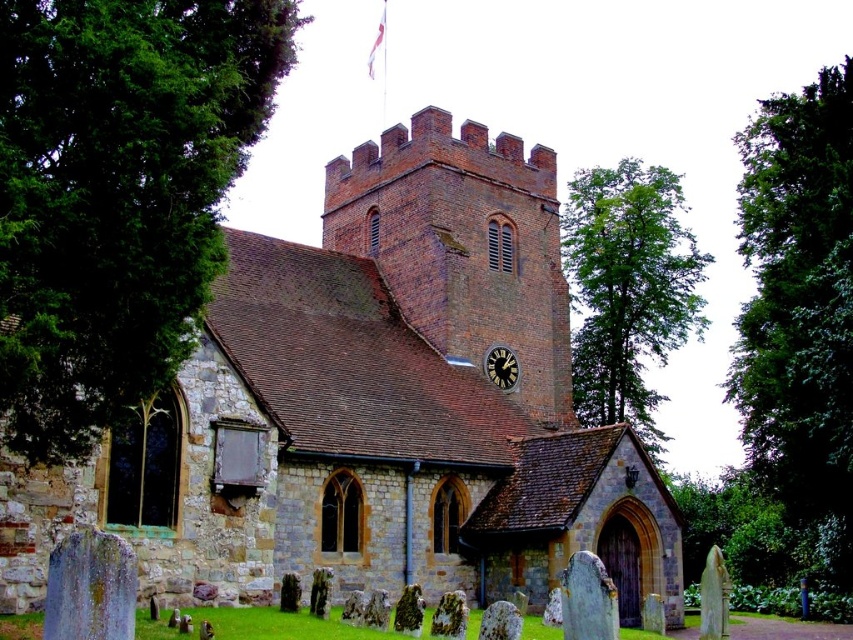
Is point (566, 406) farther from camera compared to point (500, 376)?

Yes, it is.

At what (x,y) coordinates should I click in order to perform the action: click on brown stone church at center. Please return your answer as a coordinate pair (x, y). The height and width of the screenshot is (640, 853). Looking at the image, I should click on (373, 408).

Where is `brown stone church at center`? The height and width of the screenshot is (640, 853). brown stone church at center is located at coordinates pos(373,408).

Which is behind, point (123, 349) or point (512, 353)?

The point (512, 353) is behind.

Can you confirm if green leafy tree at left is bigger than black metal clock at upper center?

Correct, green leafy tree at left is larger in size than black metal clock at upper center.

Measure the distance between point (6,22) and camera.

Point (6,22) is 90.09 feet from camera.

Image resolution: width=853 pixels, height=640 pixels. In order to click on green leafy tree at left in this screenshot , I will do `click(117, 195)`.

Does brown stone church at center have a smaller size compared to green leafy tree at upper right?

Yes, brown stone church at center is smaller than green leafy tree at upper right.

Who is more forward, (357, 449) or (839, 548)?

Point (357, 449) is more forward.

Where is `brown stone church at center`? This screenshot has height=640, width=853. brown stone church at center is located at coordinates (x=373, y=408).